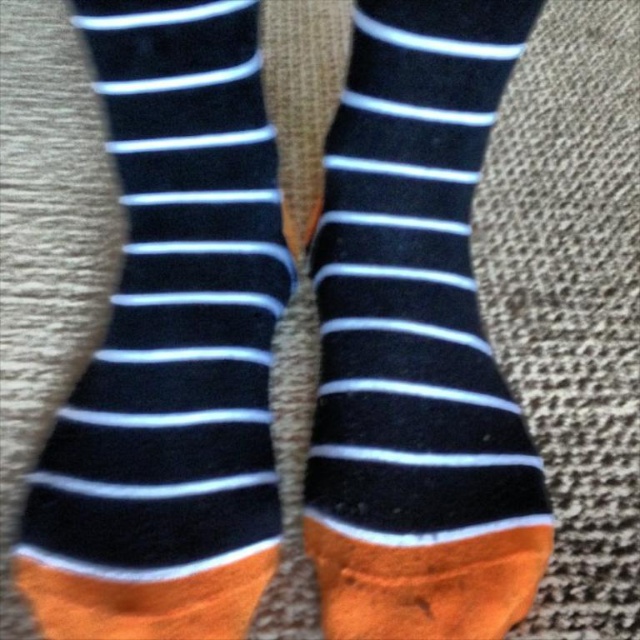
Who is shorter, matte black and orange socks at center or navy blue/white striped sock at center?

matte black and orange socks at center is shorter.

Could you measure the distance between matte black and orange socks at center and navy blue/white striped sock at center?

A distance of 4.97 inches exists between matte black and orange socks at center and navy blue/white striped sock at center.

Where is `matte black and orange socks at center`? matte black and orange socks at center is located at coordinates (170, 346).